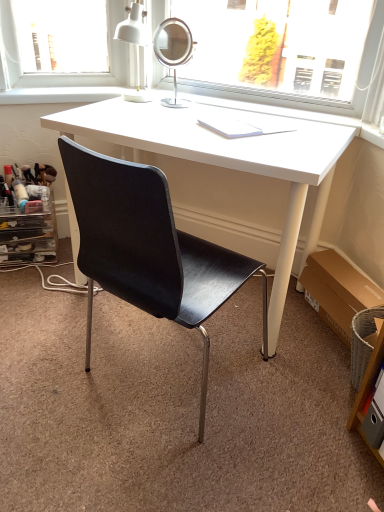
Where is `vacant area that lies to the right of black leather chair at center`? This screenshot has width=384, height=512. vacant area that lies to the right of black leather chair at center is located at coordinates (x=287, y=411).